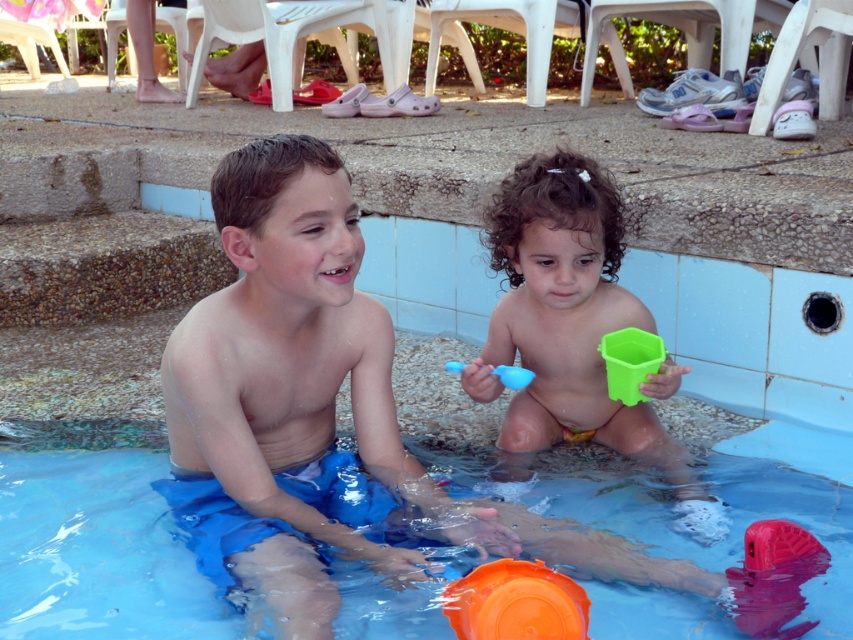
Question: Among these points, which one is nearest to the camera?

Choices:
 (A) (781, 612)
 (B) (561, 579)

Answer: (B)

Question: Which point is farther from the camera taking this photo?

Choices:
 (A) (585, 618)
 (B) (453, 362)
 (C) (714, 284)

Answer: (C)

Question: Which object is the closest to the blue fabric shorts at center?

Choices:
 (A) blue plastic pool at center
 (B) pink rubber duck at lower right
 (C) green plastic cup at center

Answer: (C)

Question: Is blue plastic pool at center positioned at the back of blue fabric shorts at center?

Choices:
 (A) yes
 (B) no

Answer: (A)

Question: Considering the relative positions of blue fabric shorts at center and orange plastic lid at lower center in the image provided, where is blue fabric shorts at center located with respect to orange plastic lid at lower center?

Choices:
 (A) below
 (B) above

Answer: (B)

Question: Is blue plastic pool at center further to the viewer compared to orange plastic lid at lower center?

Choices:
 (A) yes
 (B) no

Answer: (A)